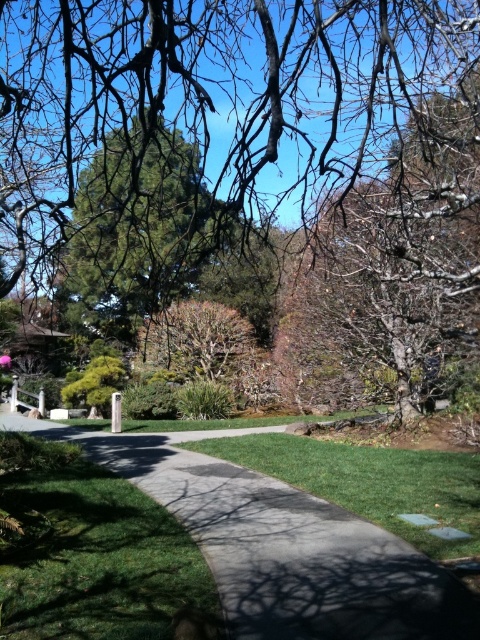
You are a gardener planning to plant flowers in the garden. You have a bag of flower seeds that requires a planting area of at least 3 square meters. Looking at the image, which area between the gray concrete pavement at center and the green grass at lower left would be suitable for planting the flowers?

The gray concrete pavement at center has a larger size compared to the green grass at lower left, so it would be suitable for planting the flowers as it meets the required area of at least 3 square meters.

You are standing at the edge of the pathway and see the green grass at lower left and the green grass at center. Which area of grass is positioned more to the left side?

The green grass at lower left is positioned to the left of the green grass at center, so the green grass at lower left is more to the left side.

You are standing at the lower left corner of the image and want to walk towards the green grass at center. According to the scene description, which direction should you move relative to the green grass at lower left?

You should move downward relative to the green grass at lower left because the green grass at lower left is above the green grass at center, so moving downward would take you towards the center grass area.